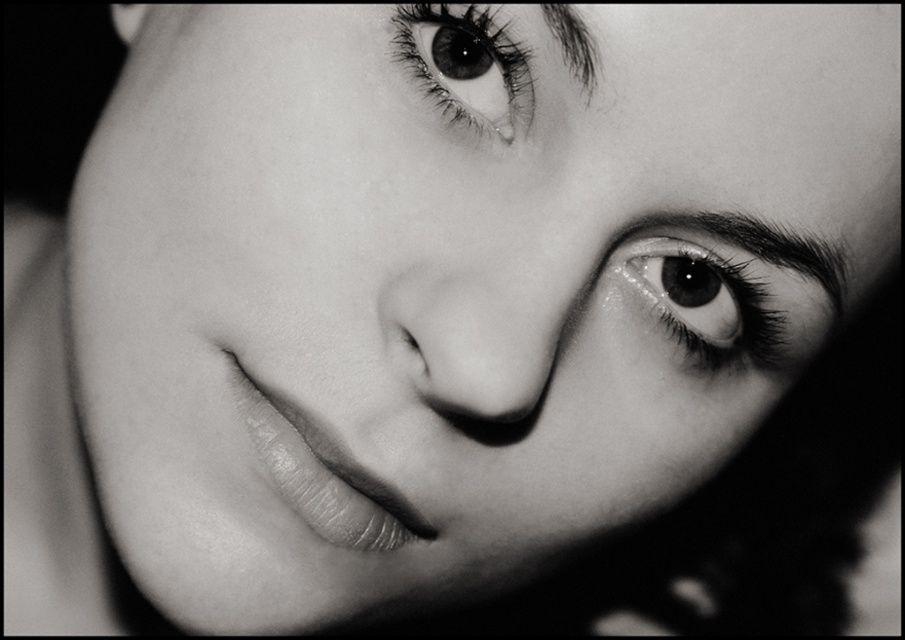
Looking at the closeup portrait, which eye is bigger between the glossy black eye at upper right and the smooth skin eye at upper center?

The glossy black eye at upper right is larger in size than the smooth skin eye at upper center.

What are the coordinates of the smooth skin eye at upper center in the image?

The smooth skin eye at upper center is located at coordinates point (467, 65).

Based on the scene description provided, where is the point labeled as point (467, 65) located on the subject?

The point labeled as point (467, 65) is located at the smooth skin eye at upper center.